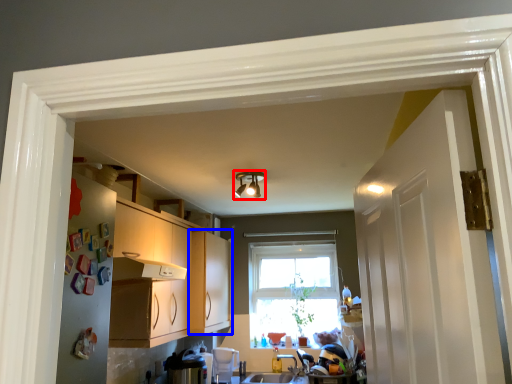
Question: Among these objects, which one is farthest to the camera, light fixture (highlighted by a red box) or cabinetry (highlighted by a blue box)?

Choices:
 (A) light fixture
 (B) cabinetry

Answer: (B)